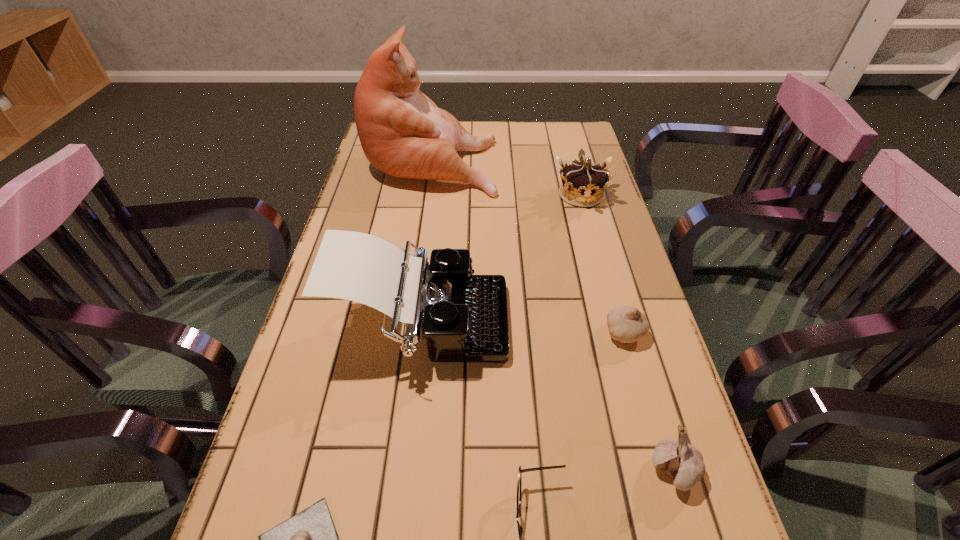
Where is `vacant space in between the typewriter and the farthest garlic`? vacant space in between the typewriter and the farthest garlic is located at coordinates (523, 328).

Identify the location of vacant area between the cat and the farthest garlic. Image resolution: width=960 pixels, height=540 pixels. (x=528, y=247).

Find the location of a particular element. vacant space in between the tallest object and the typewriter is located at coordinates (427, 242).

This screenshot has height=540, width=960. I want to click on vacant space that is in between the second nearest garlic and the second tallest garlic, so click(649, 401).

Locate an element on the screen. The image size is (960, 540). free space between the typewriter and the tallest garlic is located at coordinates (547, 397).

Where is `free space between the cat and the third shortest object`? free space between the cat and the third shortest object is located at coordinates (528, 247).

Point out which object is positioned as the second nearest to the third tallest object. Please provide its 2D coordinates. Your answer should be formatted as a tuple, i.e. [(x, y)], where the tuple contains the x and y coordinates of a point satisfying the conditions above.

[(464, 318)]

The width and height of the screenshot is (960, 540). I want to click on object identified as the third closest to the tallest garlic, so click(x=464, y=318).

Find the location of `garlic that stands as the closest to the leftmost garlic`. garlic that stands as the closest to the leftmost garlic is located at coordinates (683, 462).

Choose which garlic is the nearest neighbor to the fourth tallest object. Please provide its 2D coordinates. Your answer should be formatted as a tuple, i.e. [(x, y)], where the tuple contains the x and y coordinates of a point satisfying the conditions above.

[(626, 324)]